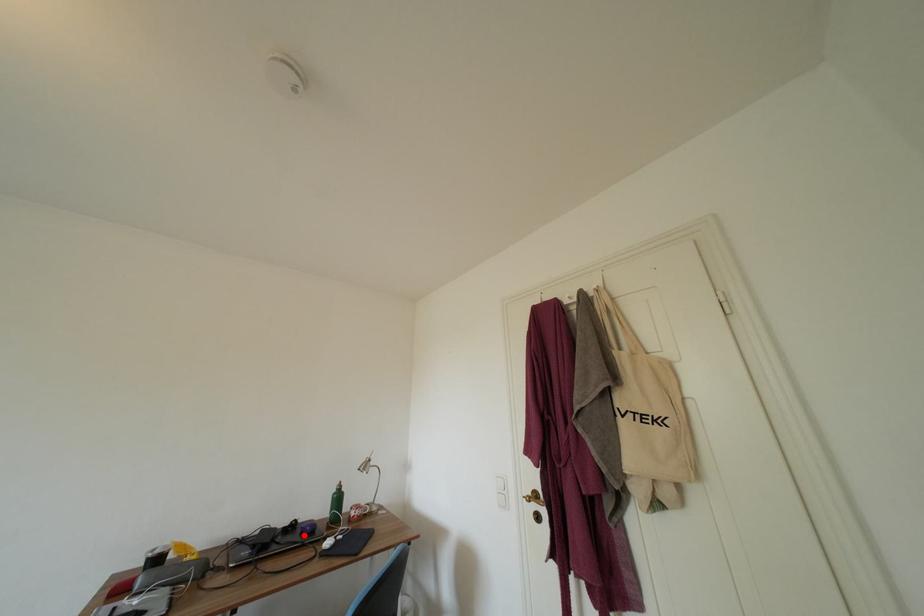
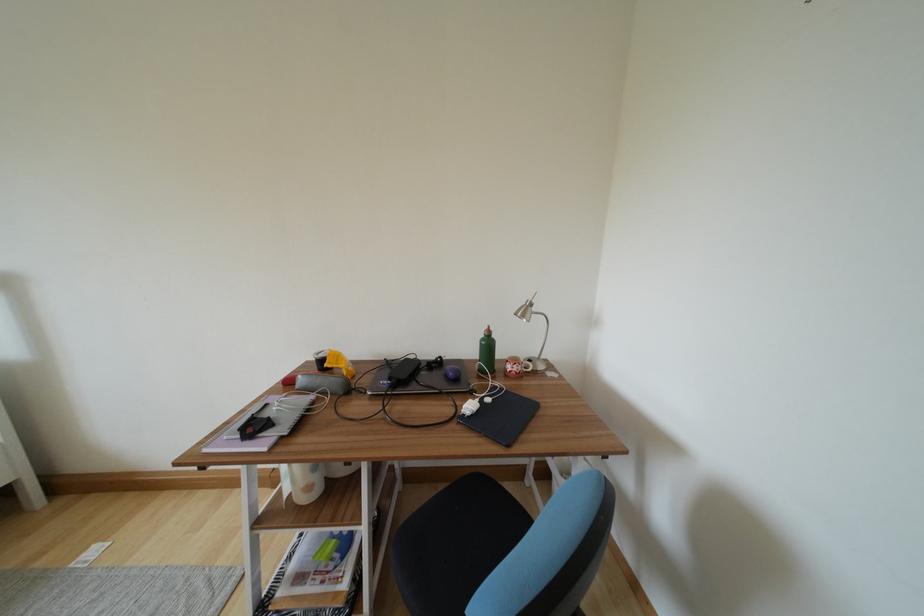
The point at the highlighted location is marked in the first image. Where is the corresponding point in the second image?

(448, 376)